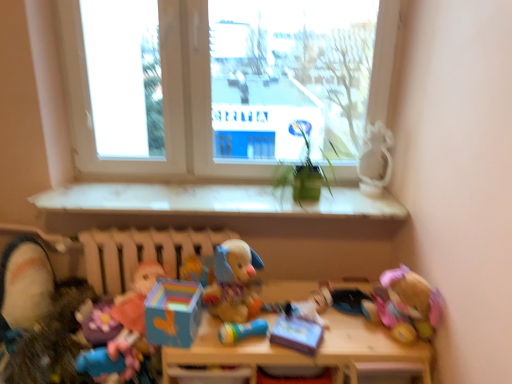
Describe the element at coordinates (296, 332) in the screenshot. I see `matte cardboard box at center, which ranks as the 3th toy in right-to-left order` at that location.

This screenshot has height=384, width=512. Find the location of `fluffy pink teddy bear at right, which is counted as the 2th toy, starting from the right`. fluffy pink teddy bear at right, which is counted as the 2th toy, starting from the right is located at coordinates [408, 305].

What is the approximate height of fluffy pink teddy bear at right, which is the ninth toy from left to right?

The height of fluffy pink teddy bear at right, which is the ninth toy from left to right, is 9.45 inches.

This screenshot has width=512, height=384. What do you see at coordinates (124, 77) in the screenshot? I see `transparent glass window at upper center, marked as the 2th window screen in a right-to-left arrangement` at bounding box center [124, 77].

Locate an element on the screen. Image resolution: width=512 pixels, height=384 pixels. multicolored plastic toy at center, marked as the sixth toy in a right-to-left arrangement is located at coordinates (198, 270).

Image resolution: width=512 pixels, height=384 pixels. Find the location of `matte cardboard box at center, the eighth toy viewed from the left`. matte cardboard box at center, the eighth toy viewed from the left is located at coordinates (296, 332).

Is wooden table at center wider than matte cardboard box at center, the 4th toy from the left?

Correct, the width of wooden table at center exceeds that of matte cardboard box at center, the 4th toy from the left.

Consider the image. From a real-world perspective, which object rests below the other?

From a 3D spatial view, wooden table at center is below.

Could you tell me if wooden table at center is facing matte cardboard box at center, the 4th toy from the left?

No, wooden table at center is not turned towards matte cardboard box at center, the 4th toy from the left.

Is wooden table at center next to matte cardboard box at center, the 7th toy from the right?

wooden table at center and matte cardboard box at center, the 7th toy from the right, are clearly separated.

Looking at this image, is rubber duck at center, the seventh toy positioned from the left, shorter than multicolored plastic toy at center, which is the fifth toy from left to right?

Yes, rubber duck at center, the seventh toy positioned from the left, is shorter than multicolored plastic toy at center, which is the fifth toy from left to right.

How different are the orientations of rubber duck at center, which is counted as the fourth toy, starting from the right, and multicolored plastic toy at center, marked as the sixth toy in a right-to-left arrangement, in degrees?

rubber duck at center, which is counted as the fourth toy, starting from the right, and multicolored plastic toy at center, marked as the sixth toy in a right-to-left arrangement, are facing 33.6 degrees away from each other.

Is rubber duck at center, the seventh toy positioned from the left, located outside multicolored plastic toy at center, marked as the sixth toy in a right-to-left arrangement?

rubber duck at center, the seventh toy positioned from the left, is positioned outside multicolored plastic toy at center, marked as the sixth toy in a right-to-left arrangement.

Do you think white glossy window sill at center is within fluffy pink teddy bear at right, which is the ninth toy from left to right, or outside of it?

white glossy window sill at center is spatially situated outside fluffy pink teddy bear at right, which is the ninth toy from left to right.

Can you tell me how much white glossy window sill at center and fluffy pink teddy bear at right, which is counted as the 2th toy, starting from the right, differ in facing direction?

54.9 degrees separate the facing orientations of white glossy window sill at center and fluffy pink teddy bear at right, which is counted as the 2th toy, starting from the right.

From the image's perspective, which is below, white glossy window sill at center or fluffy pink teddy bear at right, which is counted as the 2th toy, starting from the right?

fluffy pink teddy bear at right, which is counted as the 2th toy, starting from the right, appears lower in the image.

From the image's perspective, which toy is the 3rd one below the white glossy window sill at center? Please provide its 2D coordinates.

[(408, 305)]

Where is `the 1st toy behind when counting from the wooden table at center`? The width and height of the screenshot is (512, 384). the 1st toy behind when counting from the wooden table at center is located at coordinates (241, 331).

In the image, is rubber duck at center, the seventh toy positioned from the left, positioned in front of or behind wooden table at center?

rubber duck at center, the seventh toy positioned from the left, is behind wooden table at center.

Considering the relative sizes of rubber duck at center, which is counted as the fourth toy, starting from the right, and wooden table at center in the image provided, is rubber duck at center, which is counted as the fourth toy, starting from the right, wider than wooden table at center?

No, rubber duck at center, which is counted as the fourth toy, starting from the right, is not wider than wooden table at center.

Considering the relative sizes of soft plush toy at lower left, the tenth toy positioned from the right, and fluffy pink teddy bear at right, which is counted as the 2th toy, starting from the right, in the image provided, is soft plush toy at lower left, the tenth toy positioned from the right, wider than fluffy pink teddy bear at right, which is counted as the 2th toy, starting from the right,?

Indeed, soft plush toy at lower left, the tenth toy positioned from the right, has a greater width compared to fluffy pink teddy bear at right, which is counted as the 2th toy, starting from the right.

Is soft plush toy at lower left, which is the first toy from left to right, aimed at fluffy pink teddy bear at right, which is the ninth toy from left to right?

No, soft plush toy at lower left, which is the first toy from left to right, is not oriented towards fluffy pink teddy bear at right, which is the ninth toy from left to right.

Can you confirm if soft plush toy at lower left, which is the first toy from left to right, is positioned to the right of fluffy pink teddy bear at right, which is the ninth toy from left to right?

No.

Does soft plush toy at lower left, which is the first toy from left to right, touch fluffy pink teddy bear at right, which is counted as the 2th toy, starting from the right?

No, soft plush toy at lower left, which is the first toy from left to right, is not in contact with fluffy pink teddy bear at right, which is counted as the 2th toy, starting from the right.

From a real-world perspective, which object stands above the other?

In real-world perspective, white glossy window sill at center is above.

You are a GUI agent. You are given a task and a screenshot of the screen. Output one action in this format:
    pyautogui.click(x=<x>, y=<y>)
    Task: Click on the window sill above the matte pink plush at lower left, which is counted as the ninth toy, starting from the right (from a real-world perspective)
    The width and height of the screenshot is (512, 384).
    Given the screenshot: What is the action you would take?
    pyautogui.click(x=215, y=200)

Could you tell me if white glossy window sill at center is turned towards matte pink plush at lower left, which is counted as the ninth toy, starting from the right?

No, white glossy window sill at center is not aimed at matte pink plush at lower left, which is counted as the ninth toy, starting from the right.

Which object is further away from the camera taking this photo, white glossy window sill at center or matte pink plush at lower left, which is counted as the 2th toy, starting from the left?

white glossy window sill at center.

Is multicolored plastic toy at center, marked as the sixth toy in a right-to-left arrangement, placed right next to blue plastic toy at lower left, the 3th toy viewed from the left?

multicolored plastic toy at center, marked as the sixth toy in a right-to-left arrangement, and blue plastic toy at lower left, the 3th toy viewed from the left, are not in contact.

Can you confirm if multicolored plastic toy at center, which is the fifth toy from left to right, is smaller than blue plastic toy at lower left, the 3th toy viewed from the left?

Actually, multicolored plastic toy at center, which is the fifth toy from left to right, might be larger than blue plastic toy at lower left, the 3th toy viewed from the left.

Which is in front, point (207, 274) or point (130, 353)?

The point (130, 353) is closer to the camera.

The height and width of the screenshot is (384, 512). Find the location of `table that is on the right side of matte cardboard box at center, the 4th toy from the left`. table that is on the right side of matte cardboard box at center, the 4th toy from the left is located at coordinates (302, 354).

This screenshot has height=384, width=512. There is a multicolored plastic toy at center, which is the fifth toy from left to right. Identify the location of the 4th toy below it (from the image's perspective). (241, 331).

Which object lies nearer to the anchor point soft plush toy at lower left, which is the first toy from left to right, plush fabric dog at center, the 6th toy from the left, or transparent glass window at center, acting as the first window screen starting from the right?

Among the two, plush fabric dog at center, the 6th toy from the left, is located nearer to soft plush toy at lower left, which is the first toy from left to right.

From the image, which object appears to be farther from green matte plant at center, multicolored plastic toy at center, marked as the sixth toy in a right-to-left arrangement, or soft plush toy at lower left, the tenth toy positioned from the right?

soft plush toy at lower left, the tenth toy positioned from the right, is further to green matte plant at center.

Estimate the real-world distances between objects in this image. Which object is further from matte pink plush at lower left, which is counted as the 2th toy, starting from the left, white glossy window sill at center or blue plastic toy at lower left, which is the eighth toy from right to left?

Based on the image, white glossy window sill at center appears to be further to matte pink plush at lower left, which is counted as the 2th toy, starting from the left.

Looking at the image, which one is located further to blue plastic toy at lower left, the 3th toy viewed from the left, fluffy pink teddy bear at right, which is counted as the 2th toy, starting from the right, or soft plush toy at lower left, the tenth toy positioned from the right?

Based on the image, fluffy pink teddy bear at right, which is counted as the 2th toy, starting from the right, appears to be further to blue plastic toy at lower left, the 3th toy viewed from the left.

Based on their spatial positions, is plush fabric dog at center, the 6th toy from the left, or white glossy window sill at center further from white matte radiator at center?

plush fabric dog at center, the 6th toy from the left.

Considering their positions, is green matte plant at center positioned closer to multicolored plastic toy at center, which is the fifth toy from left to right, than matte cardboard box at center, the eighth toy viewed from the left?

matte cardboard box at center, the eighth toy viewed from the left, is positioned closer to the anchor multicolored plastic toy at center, which is the fifth toy from left to right.

Looking at the image, which one is located further to matte cardboard box at center, the eighth toy viewed from the left, wooden table at center or fluffy pink teddy bear at right, which is counted as the 2th toy, starting from the right?

fluffy pink teddy bear at right, which is counted as the 2th toy, starting from the right, lies further to matte cardboard box at center, the eighth toy viewed from the left, than the other object.

Based on their spatial positions, is white matte radiator at center or soft plush toy at lower left, the tenth toy positioned from the right, further from matte cardboard box at center, the eighth toy viewed from the left?

soft plush toy at lower left, the tenth toy positioned from the right, is further to matte cardboard box at center, the eighth toy viewed from the left.

Where is `radiator between white glossy window sill at center and matte cardboard box at center, the 7th toy from the right, vertically`? The image size is (512, 384). radiator between white glossy window sill at center and matte cardboard box at center, the 7th toy from the right, vertically is located at coordinates (141, 253).

Identify the location of radiator between transparent glass window at center, positioned as the second window screen in left-to-right order, and blue plastic toy at lower left, the 3th toy viewed from the left, vertically. The width and height of the screenshot is (512, 384). (141, 253).

Find the location of a particular element. The width and height of the screenshot is (512, 384). window screen between transparent glass window at upper center, marked as the 2th window screen in a right-to-left arrangement, and rubber duck at center, the seventh toy positioned from the left, vertically is located at coordinates (290, 77).

Locate an element on the screen. The image size is (512, 384). table between blue plastic toy at lower left, the 3th toy viewed from the left, and white glossy statue at upper right, which is counted as the tenth toy, starting from the left is located at coordinates (302, 354).